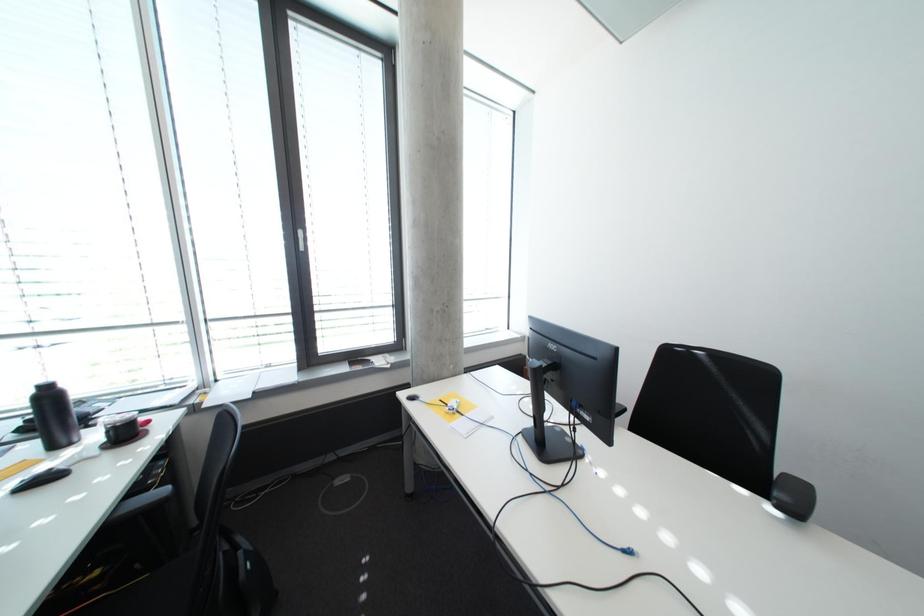
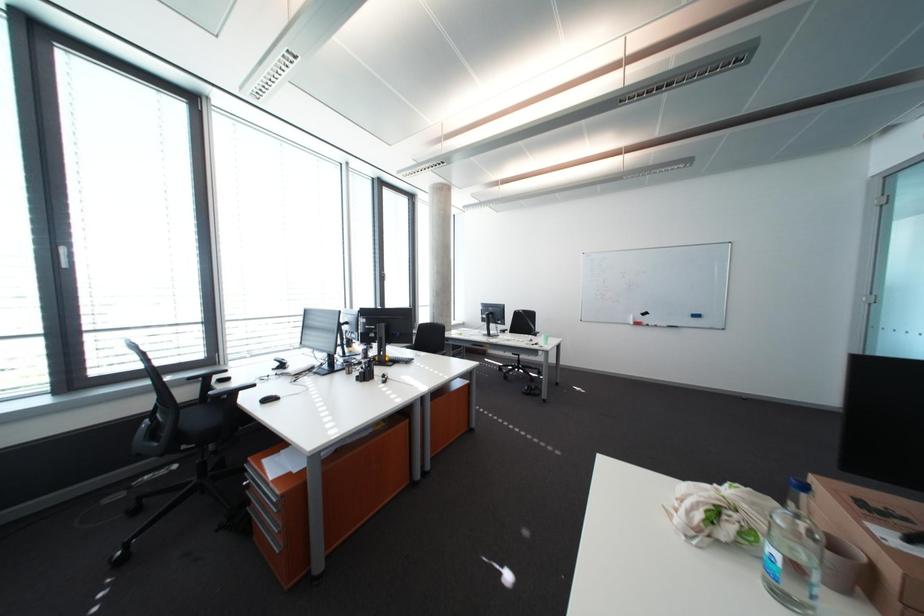
Which direction would the cameraman need to move to produce the second image?

The movement direction of the cameraman is left, backward.